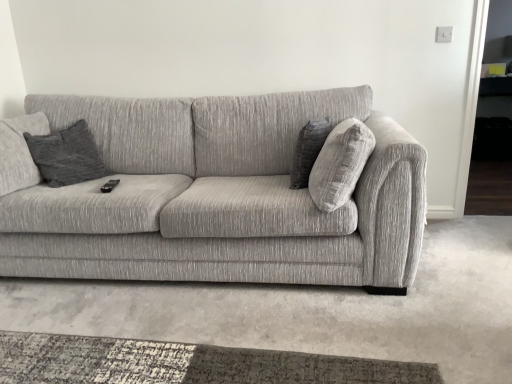
Question: Does textured gray couch at center have a smaller size compared to dark gray textured pillow at center?

Choices:
 (A) yes
 (B) no

Answer: (B)

Question: Is textured gray couch at center oriented away from dark gray textured pillow at center?

Choices:
 (A) yes
 (B) no

Answer: (A)

Question: Could you tell me if textured gray couch at center is turned towards dark gray textured pillow at center?

Choices:
 (A) no
 (B) yes

Answer: (B)

Question: Are textured gray couch at center and dark gray textured pillow at center located far from each other?

Choices:
 (A) yes
 (B) no

Answer: (B)

Question: From a real-world perspective, is textured gray couch at center on dark gray textured pillow at center?

Choices:
 (A) no
 (B) yes

Answer: (A)

Question: Is textured gray couch at center in front of dark gray textured pillow at center?

Choices:
 (A) yes
 (B) no

Answer: (A)

Question: Does dark gray textured pillow at center touch textured gray couch at center?

Choices:
 (A) no
 (B) yes

Answer: (A)

Question: Does dark gray textured pillow at center come in front of textured gray couch at center?

Choices:
 (A) no
 (B) yes

Answer: (A)

Question: Are dark gray textured pillow at center and textured gray couch at center far apart?

Choices:
 (A) yes
 (B) no

Answer: (B)

Question: Considering the relative sizes of dark gray textured pillow at center and textured gray couch at center in the image provided, is dark gray textured pillow at center taller than textured gray couch at center?

Choices:
 (A) yes
 (B) no

Answer: (B)

Question: Is dark gray textured pillow at center to the right of textured gray couch at center from the viewer's perspective?

Choices:
 (A) no
 (B) yes

Answer: (B)

Question: From a real-world perspective, is dark gray textured pillow at center positioned over textured gray couch at center based on gravity?

Choices:
 (A) no
 (B) yes

Answer: (B)

Question: From the image's perspective, is textured gray couch at center positioned above or below dark gray textured pillow at center?

Choices:
 (A) below
 (B) above

Answer: (A)